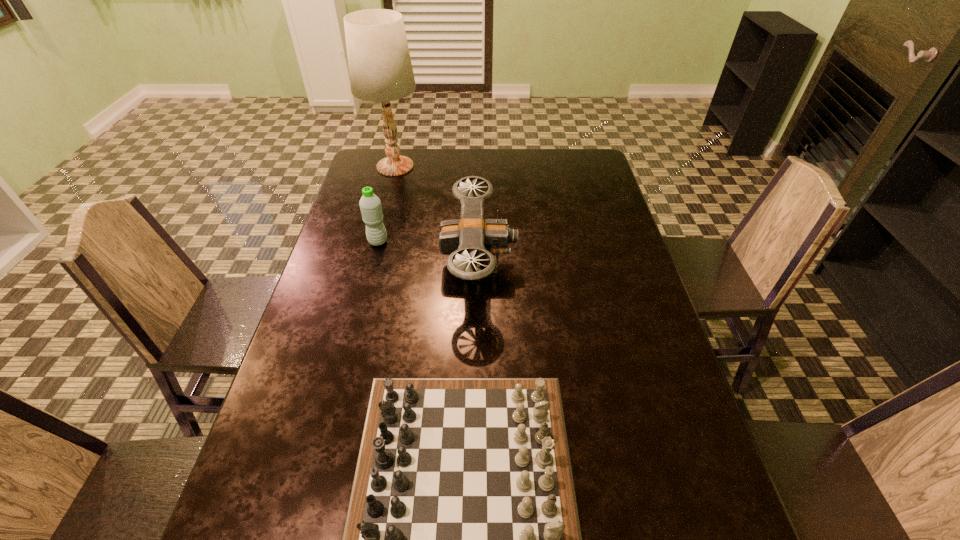
This screenshot has height=540, width=960. Identify the location of the farthest object. (380, 69).

Where is `the tallest object`? Image resolution: width=960 pixels, height=540 pixels. the tallest object is located at coordinates (380, 69).

This screenshot has width=960, height=540. I want to click on water bottle, so click(x=370, y=205).

Find the location of a particular element. This screenshot has width=960, height=540. drone is located at coordinates (471, 235).

At what (x,y) coordinates should I click in order to perform the action: click on vacant space located 0.310m on the front of the tallest object. Please return your answer as a coordinate pair (x, y). The image size is (960, 540). Looking at the image, I should click on (377, 237).

You are a GUI agent. You are given a task and a screenshot of the screen. Output one action in this format:
    pyautogui.click(x=<x>, y=<y>)
    Task: Click on the free space located 0.090m on the back of the water bottle
    Image resolution: width=960 pixels, height=540 pixels.
    Given the screenshot: What is the action you would take?
    pyautogui.click(x=384, y=218)

The image size is (960, 540). Find the location of `vacant space located 0.310m on the front-facing side of the drone`. vacant space located 0.310m on the front-facing side of the drone is located at coordinates (621, 262).

In order to click on object at the far edge in this screenshot , I will do `click(380, 69)`.

Locate an element on the screen. lamp situated at the left edge is located at coordinates (380, 69).

Locate an element on the screen. The image size is (960, 540). water bottle that is positioned at the left edge is located at coordinates (370, 205).